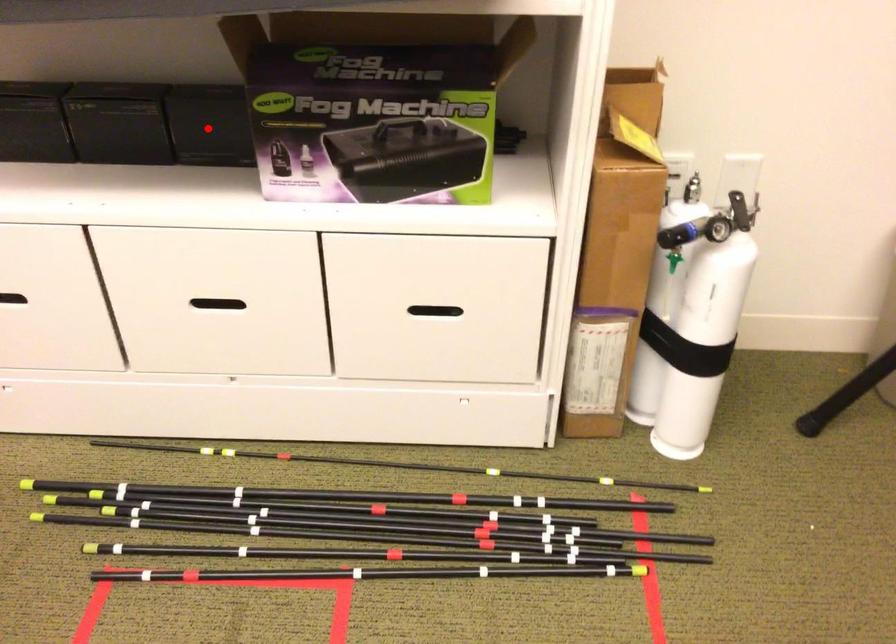
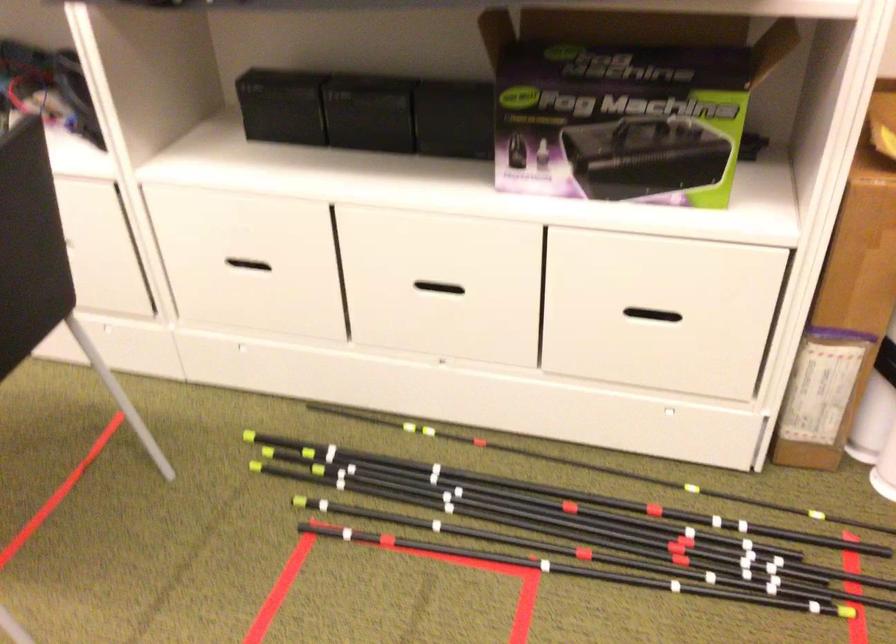
Find the pixel in the second image that matches the highlighted location in the first image.

(453, 118)